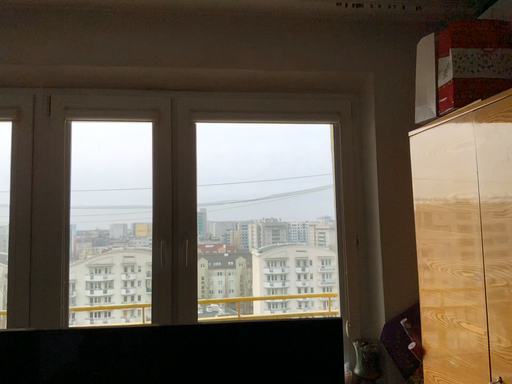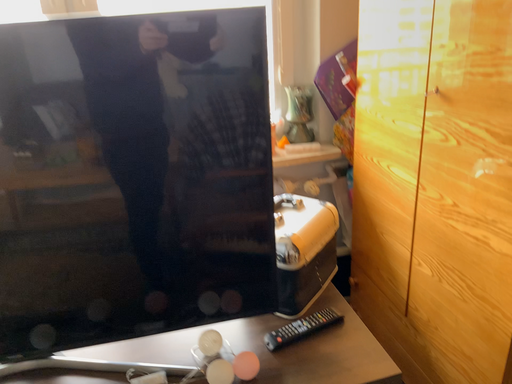
Question: Which way did the camera rotate in the video?

Choices:
 (A) rotated upward
 (B) rotated downward

Answer: (B)